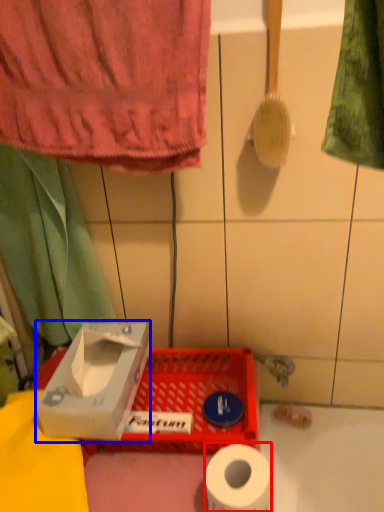
Question: Among these objects, which one is nearest to the camera, toilet paper (highlighted by a red box) or cardboard box (highlighted by a blue box)?

Choices:
 (A) toilet paper
 (B) cardboard box

Answer: (A)